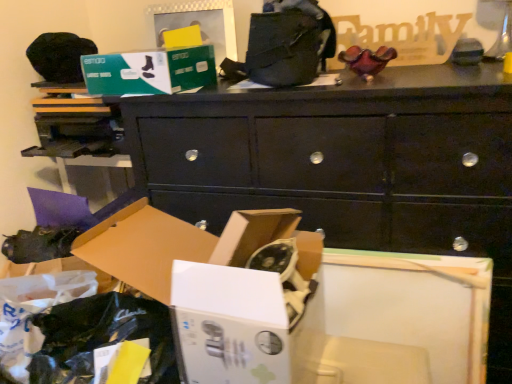
Question: Does matte black shoe at lower left have a lesser width compared to green cardboard box at upper center, which ranks as the 2th storage box in bottom-to-top order?

Choices:
 (A) yes
 (B) no

Answer: (A)

Question: Can we say matte black shoe at lower left lies outside green cardboard box at upper center, which ranks as the 2th storage box in bottom-to-top order?

Choices:
 (A) no
 (B) yes

Answer: (B)

Question: From the image's perspective, is matte black shoe at lower left on top of green cardboard box at upper center, which ranks as the 2th storage box in bottom-to-top order?

Choices:
 (A) no
 (B) yes

Answer: (A)

Question: From the image's perspective, does matte black shoe at lower left appear lower than green cardboard box at upper center, placed as the first storage box when sorted from top to bottom?

Choices:
 (A) yes
 (B) no

Answer: (A)

Question: Does matte black shoe at lower left have a lesser height compared to green cardboard box at upper center, which ranks as the 2th storage box in bottom-to-top order?

Choices:
 (A) yes
 (B) no

Answer: (A)

Question: In terms of width, does green cardboard box at upper center, placed as the first storage box when sorted from top to bottom, look wider or thinner when compared to matte black shoe at lower left?

Choices:
 (A) wide
 (B) thin

Answer: (A)

Question: Considering the relative positions of green cardboard box at upper center, which ranks as the 2th storage box in bottom-to-top order, and matte black shoe at lower left in the image provided, is green cardboard box at upper center, which ranks as the 2th storage box in bottom-to-top order, to the left or to the right of matte black shoe at lower left?

Choices:
 (A) left
 (B) right

Answer: (B)

Question: Does point (120, 89) appear closer or farther from the camera than point (74, 236)?

Choices:
 (A) closer
 (B) farther

Answer: (A)

Question: Looking at the image, does green cardboard box at upper center, placed as the first storage box when sorted from top to bottom, seem bigger or smaller compared to matte black shoe at lower left?

Choices:
 (A) small
 (B) big

Answer: (B)

Question: From the image's perspective, is white cardboard box at lower left, the second storage box viewed from the top, above or below black matte chest of drawers at center?

Choices:
 (A) below
 (B) above

Answer: (A)

Question: In terms of size, does white cardboard box at lower left, the 1th storage box from the bottom, appear bigger or smaller than black matte chest of drawers at center?

Choices:
 (A) small
 (B) big

Answer: (A)

Question: Looking at their shapes, would you say white cardboard box at lower left, the second storage box viewed from the top, is wider or thinner than black matte chest of drawers at center?

Choices:
 (A) wide
 (B) thin

Answer: (B)

Question: Is white cardboard box at lower left, the 1th storage box from the bottom, taller or shorter than black matte chest of drawers at center?

Choices:
 (A) short
 (B) tall

Answer: (A)

Question: From a real-world perspective, relative to black matte chest of drawers at center, is green cardboard box at upper center, placed as the first storage box when sorted from top to bottom, vertically above or below?

Choices:
 (A) below
 (B) above

Answer: (B)

Question: Is green cardboard box at upper center, which ranks as the 2th storage box in bottom-to-top order, taller or shorter than black matte chest of drawers at center?

Choices:
 (A) tall
 (B) short

Answer: (B)